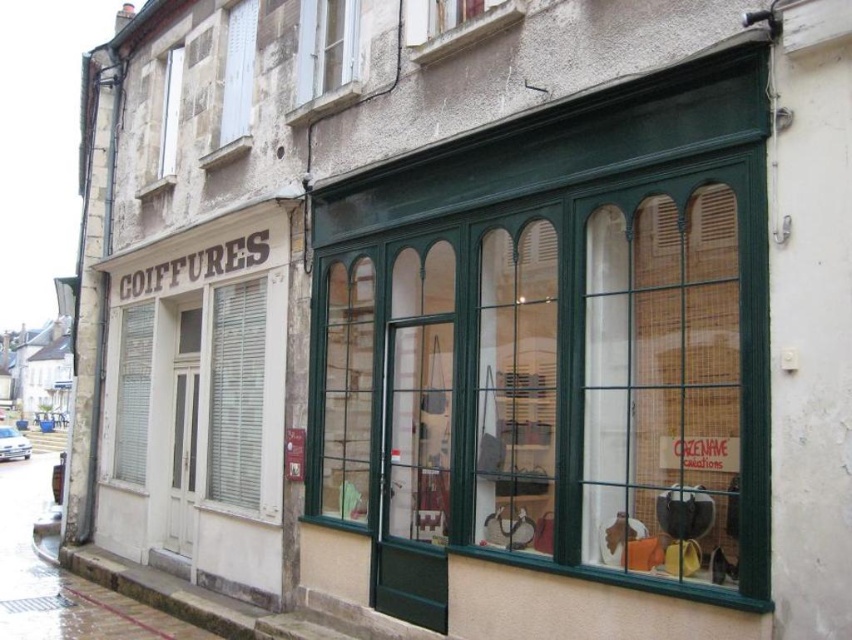
Does point (252, 346) come closer to viewer compared to point (229, 86)?

Yes, it is in front of point (229, 86).

Consider the image. Is white plastic shutters at center behind white wooden shutter at upper left?

Answer: That is False.

Locate an element on the screen. This screenshot has height=640, width=852. white plastic shutters at center is located at coordinates (235, 394).

Between white wood shutter at left and white wooden window at upper center, which one is positioned higher?

Positioned higher is white wooden window at upper center.

Image resolution: width=852 pixels, height=640 pixels. What are the coordinates of `white wood shutter at left` in the screenshot? It's located at (131, 392).

Is point (147, 372) closer to camera compared to point (298, 33)?

No, (147, 372) is further to viewer.

Identify the location of white wood shutter at left. The width and height of the screenshot is (852, 640). (131, 392).

Between white wood shutter at left and white wooden shutter at upper left, which one is positioned lower?

white wood shutter at left is below.

Is white wood shutter at left taller than white wooden shutter at upper left?

Yes.

Does point (151, 340) come in front of point (229, 29)?

No, it is not.

I want to click on white wood shutter at left, so click(131, 392).